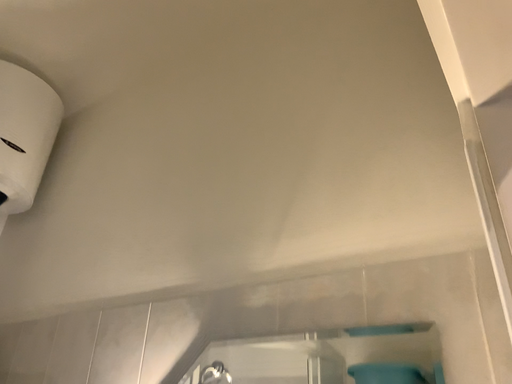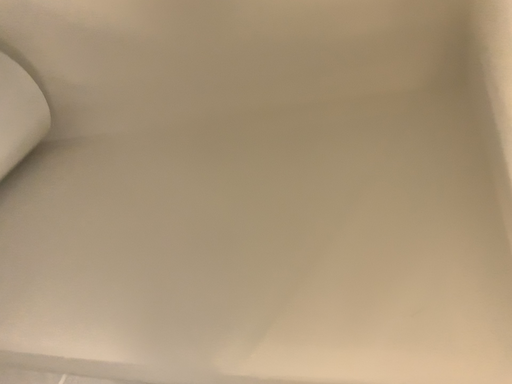
Question: Which way did the camera rotate in the video?

Choices:
 (A) rotated right
 (B) rotated left

Answer: (A)